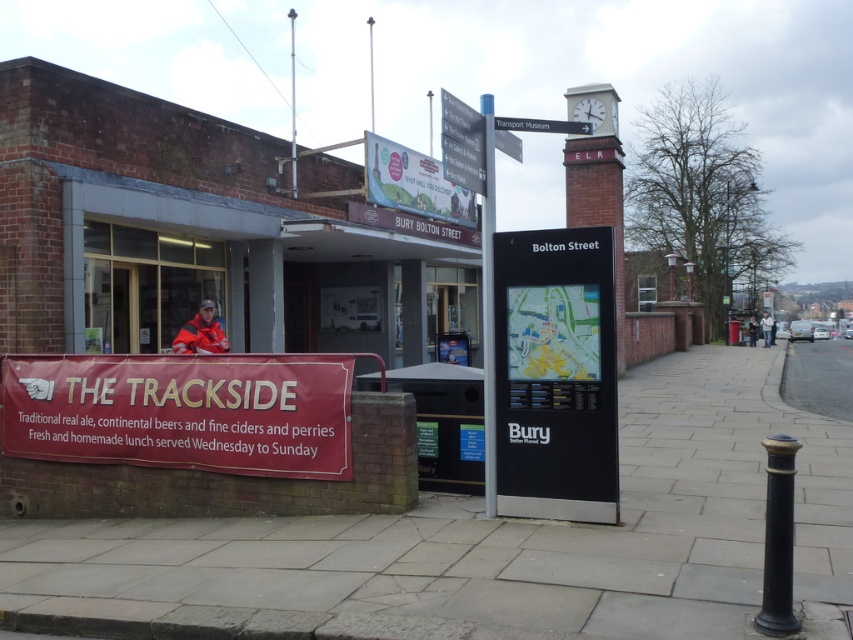
Question: Does smooth concrete pavement at lower center have a lesser width compared to matte red banner at lower left?

Choices:
 (A) no
 (B) yes

Answer: (A)

Question: Is matte plastic sign at upper center behind red jacket at center?

Choices:
 (A) no
 (B) yes

Answer: (A)

Question: Which object is farther from the camera taking this photo?

Choices:
 (A) smooth concrete pavement at lower center
 (B) matte red banner at lower left

Answer: (B)

Question: Does matte plastic sign at upper center appear over metallic gray sign at upper center?

Choices:
 (A) yes
 (B) no

Answer: (B)

Question: Which point is closer to the camera taking this photo?

Choices:
 (A) (425, 160)
 (B) (747, 340)

Answer: (A)

Question: Which object is closer to the camera taking this photo?

Choices:
 (A) black plastic map at center
 (B) matte plastic sign at upper center

Answer: (A)